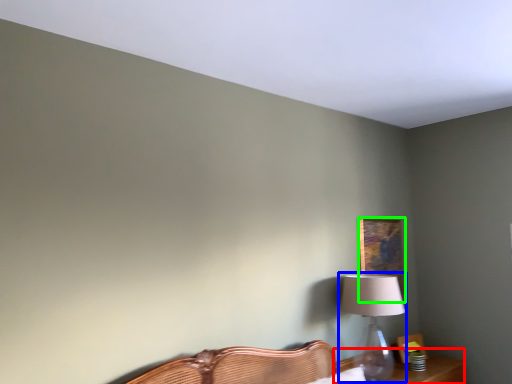
Question: Which object is positioned closest to table (highlighted by a red box)? Select from table lamp (highlighted by a blue box) and picture frame (highlighted by a green box).

Choices:
 (A) table lamp
 (B) picture frame

Answer: (A)